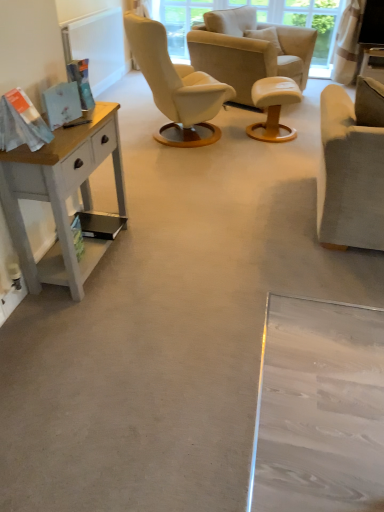
Question: Can you confirm if suede beige armchair at right, the 1th chair in the bottom-to-top sequence, is taller than suede beige armchair at center, acting as the second chair starting from the bottom?

Choices:
 (A) no
 (B) yes

Answer: (B)

Question: From the image's perspective, does suede beige armchair at right, placed as the 2th chair when sorted from back to front, appear higher than suede beige armchair at center, which appears as the 2th chair when viewed from the front?

Choices:
 (A) yes
 (B) no

Answer: (B)

Question: Is suede beige armchair at right, the 1th chair in the bottom-to-top sequence, outside of suede beige armchair at center, acting as the second chair starting from the bottom?

Choices:
 (A) yes
 (B) no

Answer: (A)

Question: Does suede beige armchair at right, the second chair in the top-to-bottom sequence, lie behind suede beige armchair at center, acting as the second chair starting from the bottom?

Choices:
 (A) no
 (B) yes

Answer: (A)

Question: Considering the relative positions of suede beige armchair at right, the first chair viewed from the front, and suede beige armchair at center, the first chair when ordered from top to bottom, in the image provided, is suede beige armchair at right, the first chair viewed from the front, to the right of suede beige armchair at center, the first chair when ordered from top to bottom, from the viewer's perspective?

Choices:
 (A) no
 (B) yes

Answer: (B)

Question: Is suede beige armchair at right, the 1th chair in the bottom-to-top sequence, wider or thinner than matte white side table at upper right?

Choices:
 (A) wide
 (B) thin

Answer: (A)

Question: In the image, is suede beige armchair at right, placed as the 2th chair when sorted from back to front, positioned in front of or behind matte white side table at upper right?

Choices:
 (A) behind
 (B) front

Answer: (B)

Question: Considering the positions of point pyautogui.click(x=324, y=190) and point pyautogui.click(x=375, y=67), is point pyautogui.click(x=324, y=190) closer or farther from the camera than point pyautogui.click(x=375, y=67)?

Choices:
 (A) closer
 (B) farther

Answer: (A)

Question: Is suede beige armchair at right, the second chair in the top-to-bottom sequence, bigger or smaller than matte white side table at upper right?

Choices:
 (A) small
 (B) big

Answer: (B)

Question: From a real-world perspective, is suede beige armchair at center, which appears as the 2th chair when viewed from the front, physically located above or below white painted wood desk at left?

Choices:
 (A) above
 (B) below

Answer: (A)

Question: Looking at their shapes, would you say suede beige armchair at center, acting as the second chair starting from the bottom, is wider or thinner than white painted wood desk at left?

Choices:
 (A) wide
 (B) thin

Answer: (A)

Question: From the image's perspective, is suede beige armchair at center, which is the 1th chair from back to front, above or below white painted wood desk at left?

Choices:
 (A) below
 (B) above

Answer: (B)

Question: Relative to white painted wood desk at left, is suede beige armchair at center, which is the 1th chair from back to front, in front or behind?

Choices:
 (A) front
 (B) behind

Answer: (B)

Question: From a real-world perspective, is white leather stool at center above or below suede beige armchair at center, which appears as the 2th chair when viewed from the front?

Choices:
 (A) below
 (B) above

Answer: (A)

Question: From their relative heights in the image, would you say white leather stool at center is taller or shorter than suede beige armchair at center, the first chair when ordered from top to bottom?

Choices:
 (A) tall
 (B) short

Answer: (B)